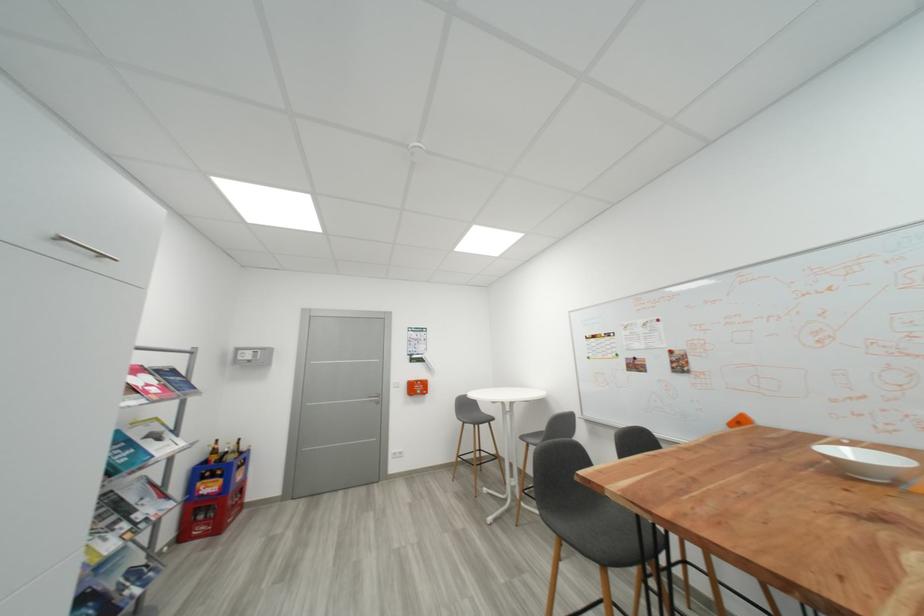
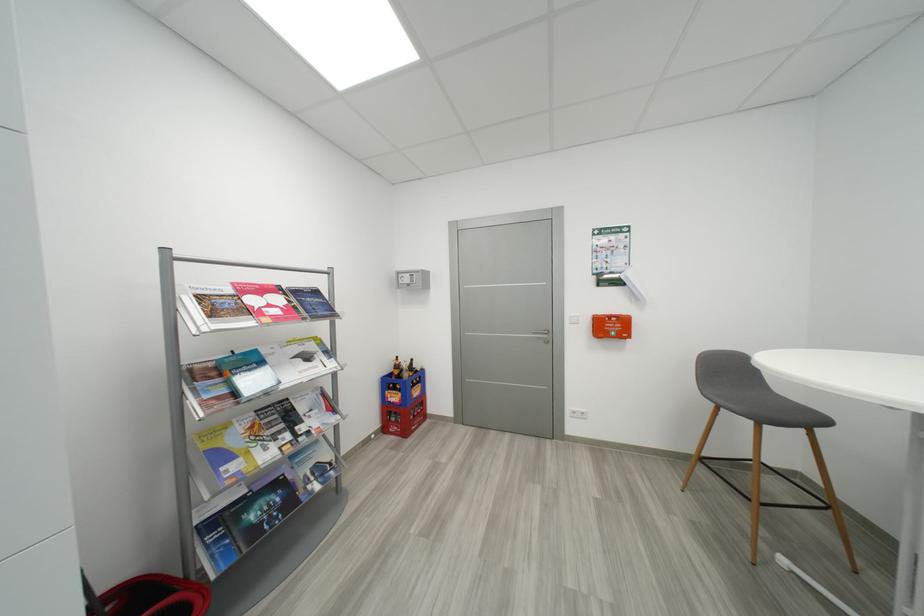
The point at (234, 454) is marked in the first image. Where is the corresponding point in the second image?

(408, 371)